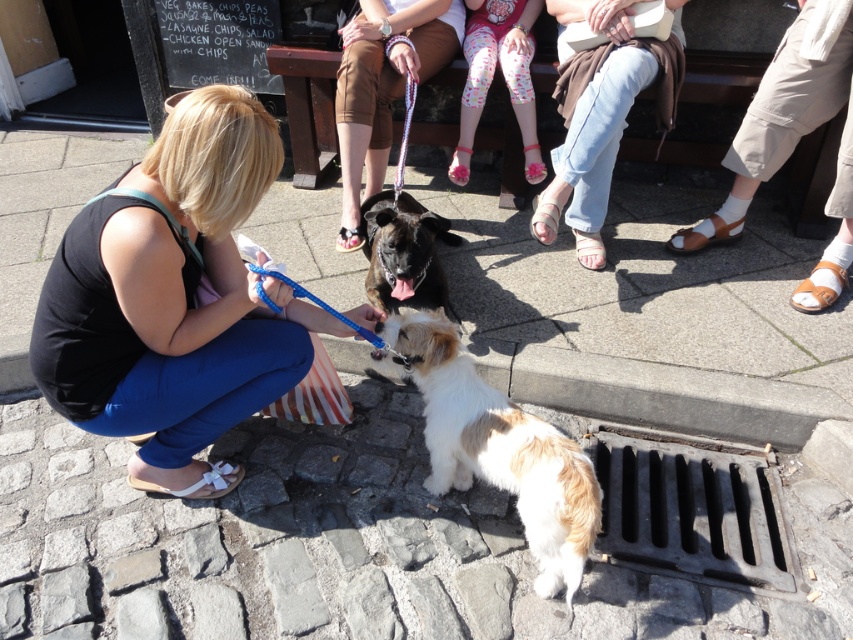
Between white-furred dog at lower center and brown fur dog at center, which one appears on the left side from the viewer's perspective?

Positioned to the left is brown fur dog at center.

Between white-furred dog at lower center and brown fur dog at center, which one has less height?

Standing shorter between the two is brown fur dog at center.

You are a GUI agent. You are given a task and a screenshot of the screen. Output one action in this format:
    pyautogui.click(x=<x>, y=<y>)
    Task: Click on the white-furred dog at lower center
    This screenshot has width=853, height=640.
    Given the screenshot: What is the action you would take?
    pyautogui.click(x=498, y=449)

Locate an element on the screen. white-furred dog at lower center is located at coordinates (498, 449).

Can you confirm if white-furred dog at lower center is shorter than light blue denim jeans at center?

Indeed, white-furred dog at lower center has a lesser height compared to light blue denim jeans at center.

How distant is white-furred dog at lower center from light blue denim jeans at center?

They are 3.83 feet apart.

Locate an element on the screen. The height and width of the screenshot is (640, 853). white-furred dog at lower center is located at coordinates (498, 449).

At what (x,y) coordinates should I click in order to perform the action: click on white-furred dog at lower center. Please return your answer as a coordinate pair (x, y). The height and width of the screenshot is (640, 853). Looking at the image, I should click on (498, 449).

Which is more to the right, black fabric at lower left or light blue denim jeans at center?

Positioned to the right is light blue denim jeans at center.

Between black fabric at lower left and light blue denim jeans at center, which one appears on the left side from the viewer's perspective?

black fabric at lower left

Does point (149, 392) come in front of point (554, 4)?

Yes, point (149, 392) is in front of point (554, 4).

Where is `black fabric at lower left`? Image resolution: width=853 pixels, height=640 pixels. black fabric at lower left is located at coordinates (173, 300).